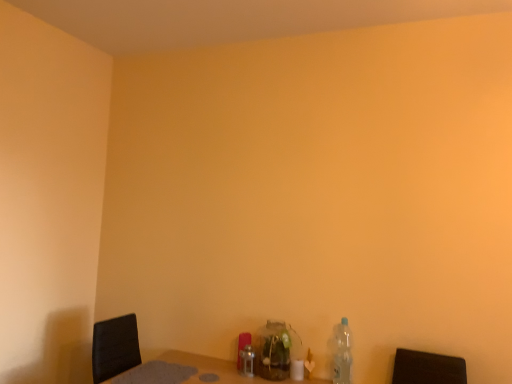
Question: Considering the positions of point (266, 359) and point (338, 382), is point (266, 359) closer or farther from the camera than point (338, 382)?

Choices:
 (A) closer
 (B) farther

Answer: (B)

Question: Considering the positions of translucent glass jar at center, the 2th bottle in the right-to-left sequence, and clear plastic bottle at lower right, marked as the third bottle in a left-to-right arrangement, in the image, is translucent glass jar at center, the 2th bottle in the right-to-left sequence, bigger or smaller than clear plastic bottle at lower right, marked as the third bottle in a left-to-right arrangement,?

Choices:
 (A) big
 (B) small

Answer: (A)

Question: Which object is the farthest from the translucent glass jar at center, placed as the second bottle when sorted from left to right?

Choices:
 (A) clear plastic bottle at lower right, marked as the third bottle in a left-to-right arrangement
 (B) brushed metal bottle at center, the third bottle when ordered from right to left

Answer: (A)

Question: Considering the real-world distances, which object is farthest from the brushed metal bottle at center, the third bottle when ordered from right to left?

Choices:
 (A) clear plastic bottle at lower right, the first bottle viewed from the right
 (B) translucent glass jar at center, the 2th bottle in the right-to-left sequence

Answer: (A)